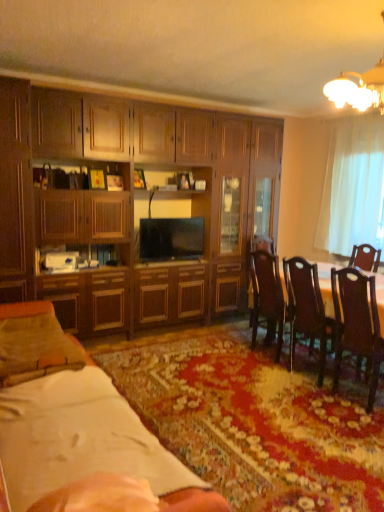
Question: In terms of size, does matte black tv at center appear bigger or smaller than suede-like beige pillow at lower left?

Choices:
 (A) big
 (B) small

Answer: (B)

Question: Is matte black tv at center taller or shorter than suede-like beige pillow at lower left?

Choices:
 (A) tall
 (B) short

Answer: (A)

Question: Considering the real-world distances, which object is farthest from the white sheer curtain at right?

Choices:
 (A) suede-like beige pillow at lower left
 (B) matte black tv at center
 (C) dark wood chair at right, the 1th chair viewed from the front
 (D) dark brown wood chair at center right, which ranks as the second chair in front-to-back order
 (E) brown wooden table at right

Answer: (A)

Question: Considering the real-world distances, which object is farthest from the suede-like beige pillow at lower left?

Choices:
 (A) brown wooden table at right
 (B) wooden cabinet at center, which is the 2th cabinetry from left to right
 (C) wooden dining table at center
 (D) white paper at lower left
 (E) matte wood cabinet at left, positioned as the first cabinetry in left-to-right order

Answer: (A)